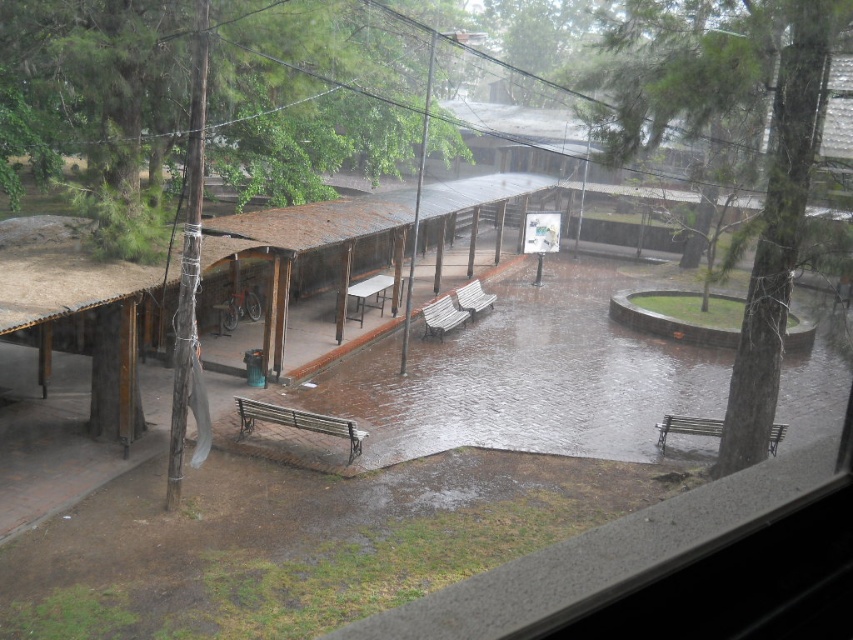
Question: Does white glossy picnic table at center have a smaller size compared to wooden park bench at center?

Choices:
 (A) yes
 (B) no

Answer: (A)

Question: Which point is farther from the camera taking this photo?

Choices:
 (A) (773, 451)
 (B) (357, 321)
 (C) (430, 304)

Answer: (C)

Question: Is rusty metal shelter at center further to camera compared to white glossy picnic table at center?

Choices:
 (A) no
 (B) yes

Answer: (A)

Question: Which point is closer to the camera taking this photo?

Choices:
 (A) (457, 292)
 (B) (664, 435)
 (C) (321, 380)
 (D) (440, 305)

Answer: (B)

Question: Does rustic wood bench at lower center have a greater width compared to wooden park bench at center?

Choices:
 (A) no
 (B) yes

Answer: (B)

Question: Which point is farther to the camera?

Choices:
 (A) (450, 323)
 (B) (357, 452)

Answer: (A)